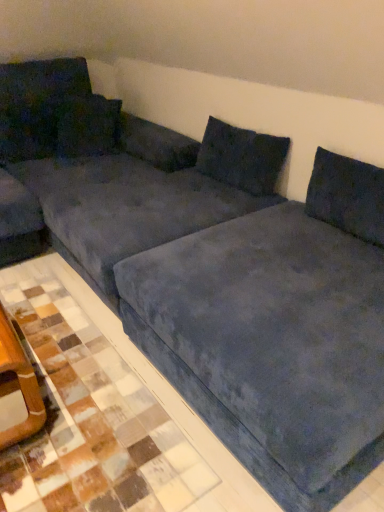
The image size is (384, 512). In order to click on free location above velvet dark blue pillow at upper left, which ranks as the third pillow in right-to-left order (from a real-world perspective) in this screenshot , I will do `click(41, 91)`.